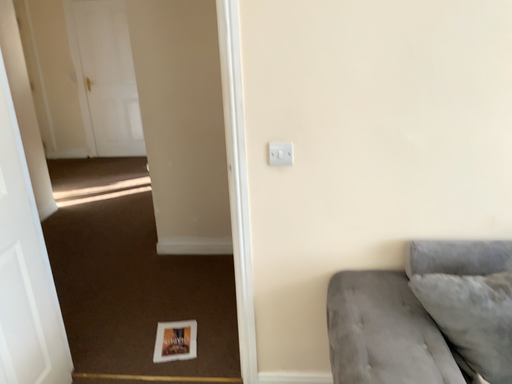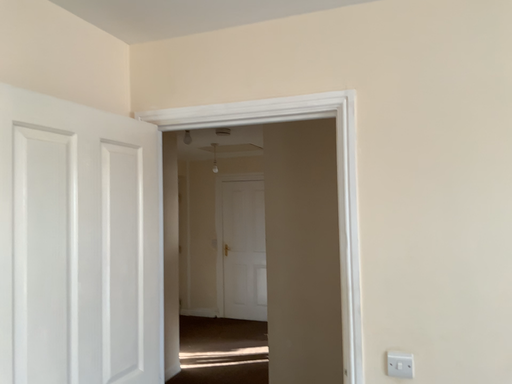
Question: How did the camera likely rotate when shooting the video?

Choices:
 (A) rotated right
 (B) rotated left

Answer: (B)